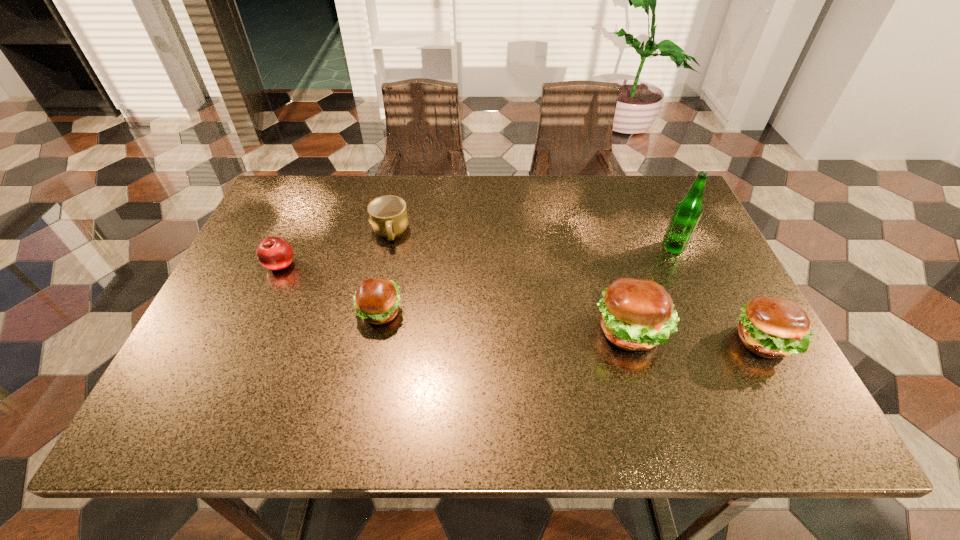
The image size is (960, 540). In order to click on free space that is in between the leftmost hamburger and the mug in this screenshot , I will do `click(385, 273)`.

Where is `free spot between the third object from right to left and the shortest hamburger`? free spot between the third object from right to left and the shortest hamburger is located at coordinates (505, 322).

Locate an element on the screen. The image size is (960, 540). free point between the apple and the second hamburger from left to right is located at coordinates (455, 298).

Identify the location of vacant point located between the fifth shortest object and the apple. This screenshot has height=540, width=960. (455, 298).

Identify the location of free area in between the shortest hamburger and the tallest hamburger. The height and width of the screenshot is (540, 960). (505, 322).

I want to click on free space between the fifth shortest object and the leftmost object, so click(x=455, y=298).

In order to click on empty location between the fifth object from left to right and the mug in this screenshot , I will do `click(532, 241)`.

The width and height of the screenshot is (960, 540). I want to click on vacant region between the fifth object from left to right and the mug, so click(x=532, y=241).

What are the coordinates of `the third closest object to the apple` in the screenshot? It's located at (637, 314).

Where is `the fourth closest object to the leftmost hamburger`? The image size is (960, 540). the fourth closest object to the leftmost hamburger is located at coordinates (688, 211).